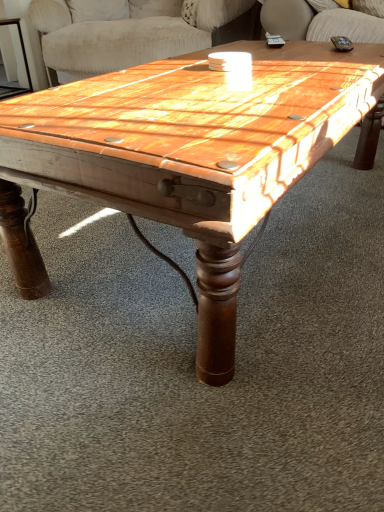
Question: From the image's perspective, does wooden side table at left appear lower than wooden coffee table at center?

Choices:
 (A) no
 (B) yes

Answer: (A)

Question: Is wooden coffee table at center located within wooden side table at left?

Choices:
 (A) yes
 (B) no

Answer: (B)

Question: Is wooden side table at left facing away from wooden coffee table at center?

Choices:
 (A) yes
 (B) no

Answer: (B)

Question: From the image's perspective, is wooden side table at left over wooden coffee table at center?

Choices:
 (A) yes
 (B) no

Answer: (A)

Question: Does wooden side table at left have a lesser height compared to wooden coffee table at center?

Choices:
 (A) yes
 (B) no

Answer: (B)

Question: Does wooden side table at left have a larger size compared to wooden coffee table at center?

Choices:
 (A) no
 (B) yes

Answer: (A)

Question: Can you confirm if wooden side table at left is positioned to the right of wooden swivel chair at upper center?

Choices:
 (A) yes
 (B) no

Answer: (B)

Question: Is wooden side table at left outside wooden swivel chair at upper center?

Choices:
 (A) no
 (B) yes

Answer: (B)

Question: Considering the relative positions of wooden side table at left and wooden swivel chair at upper center in the image provided, is wooden side table at left to the left of wooden swivel chair at upper center from the viewer's perspective?

Choices:
 (A) no
 (B) yes

Answer: (B)

Question: Can you confirm if wooden side table at left is bigger than wooden swivel chair at upper center?

Choices:
 (A) yes
 (B) no

Answer: (B)

Question: Does wooden side table at left turn towards wooden swivel chair at upper center?

Choices:
 (A) no
 (B) yes

Answer: (A)

Question: Is wooden side table at left with wooden swivel chair at upper center?

Choices:
 (A) yes
 (B) no

Answer: (B)

Question: Is wooden swivel chair at upper center at the right side of wooden coffee table at center?

Choices:
 (A) yes
 (B) no

Answer: (B)